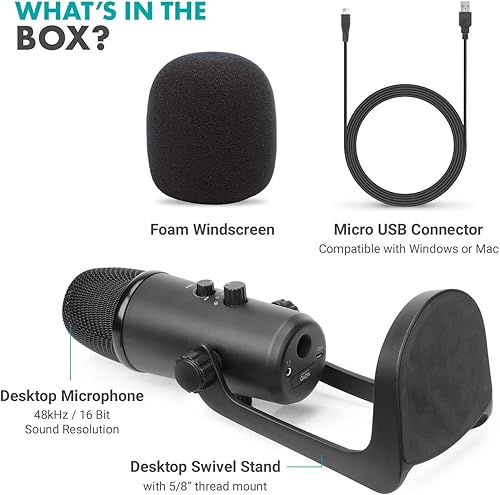
The height and width of the screenshot is (495, 500). Find the location of `mic`. mic is located at coordinates click(x=380, y=195), click(x=202, y=303).